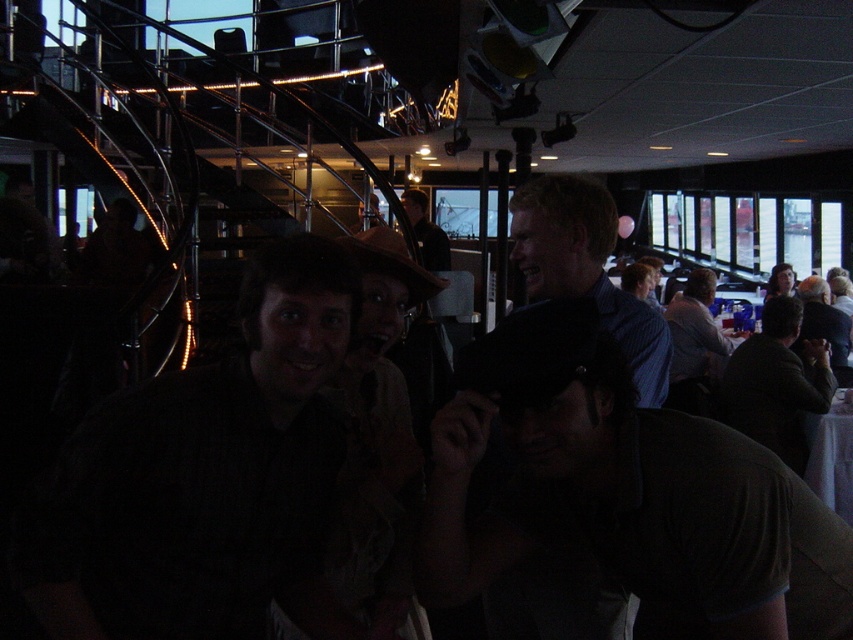
Question: Is dark brown fabric cap at lower center smaller than dark brown leather jacket at upper center?

Choices:
 (A) yes
 (B) no

Answer: (A)

Question: In this image, where is matte brown hat at center located relative to dark brown leather jacket at right?

Choices:
 (A) left
 (B) right

Answer: (A)

Question: Which of the following is the closest to the observer?

Choices:
 (A) (438, 244)
 (B) (734, 429)
 (C) (643, 394)

Answer: (C)

Question: Which object appears closest to the camera in this image?

Choices:
 (A) light brown shirt at center
 (B) dark brown leather jacket at right
 (C) dark brown fabric cap at lower center

Answer: (C)

Question: Is dark brown shirt at center thinner than light brown shirt at center?

Choices:
 (A) no
 (B) yes

Answer: (A)

Question: Estimate the real-world distances between objects in this image. Which object is closer to the dark brown shirt at center?

Choices:
 (A) matte brown hat at center
 (B) dark brown leather jacket at right
 (C) dark brown leather jacket at upper center
 (D) light brown shirt at center

Answer: (A)